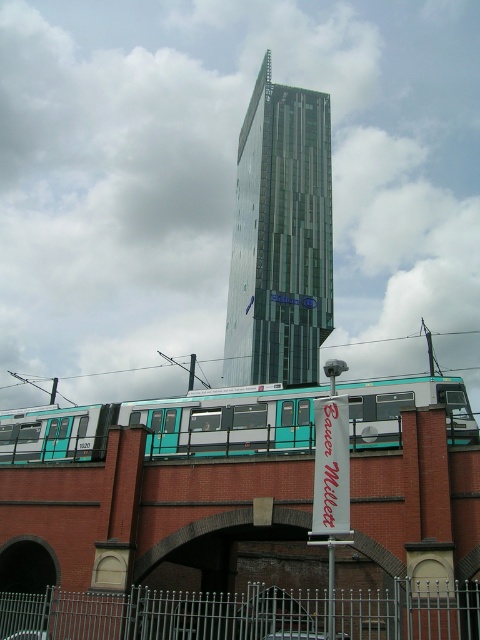
You are a photographer standing on the bridge. You want to capture both the glassy metallic skyscraper at center and the teal matte train at center in your shot. Which object will appear larger in the photo?

The glassy metallic skyscraper at center will appear larger in the photo because it is much taller than the teal matte train at center.

You are standing on the brick bridge and want to take a photo of the glassy metallic skyscraper at center and the teal matte train at center. Which object should you position to your left to include both in the frame?

You should position the teal matte train at center to your left because the glassy metallic skyscraper at center is to the right of it, so placing the train on your left will allow both to be captured in the photo frame.

You are standing at the base of the glassy metallic skyscraper at center. You want to take a photo of the entire building. Your camera can focus on objects up to 100 meters away. Will the skyscraper be in focus?

The glassy metallic skyscraper at center is 104.37 meters away from the viewer. Since the camera can only focus up to 100 meters, the skyscraper will not be in focus.